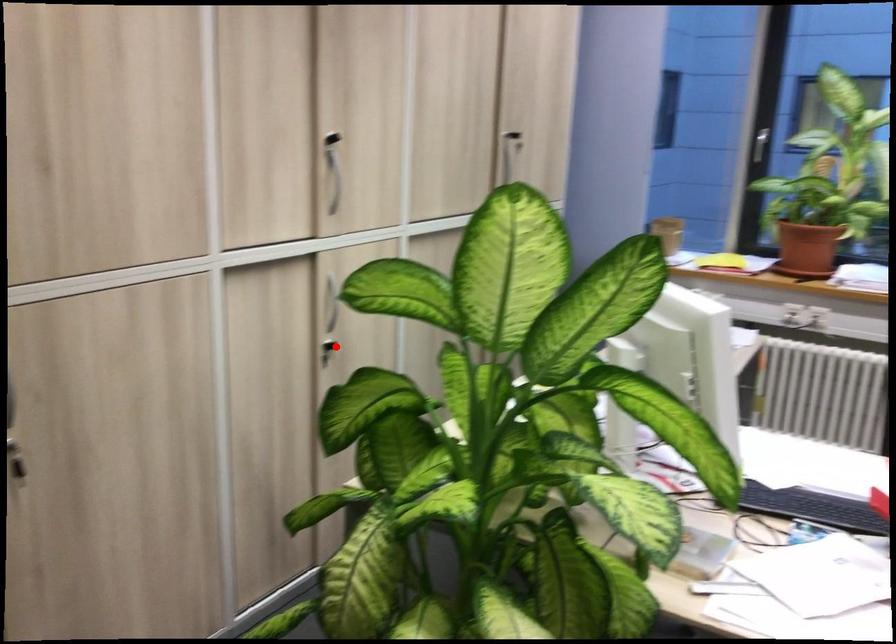
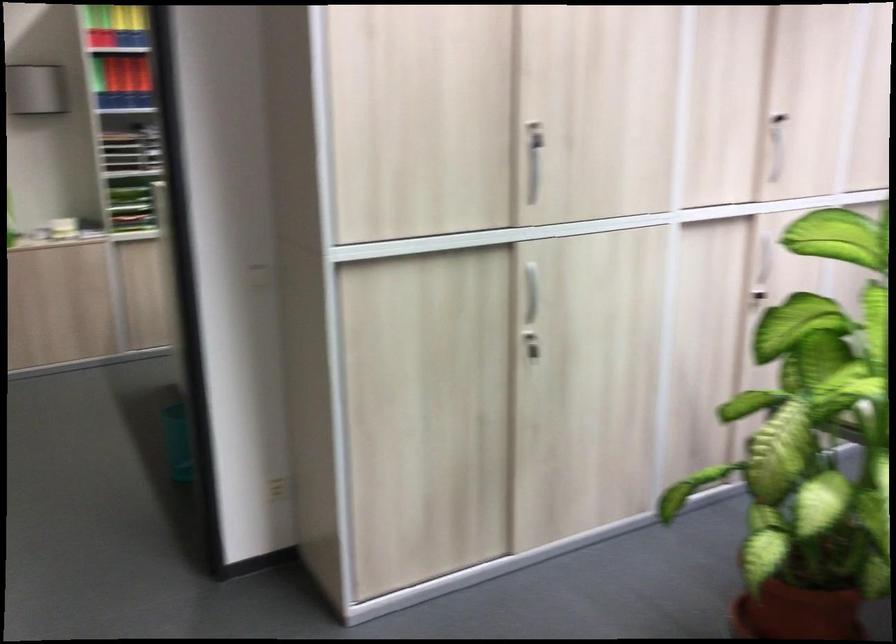
In the second image, find the point that corresponds to the highlighted location in the first image.

(759, 299)